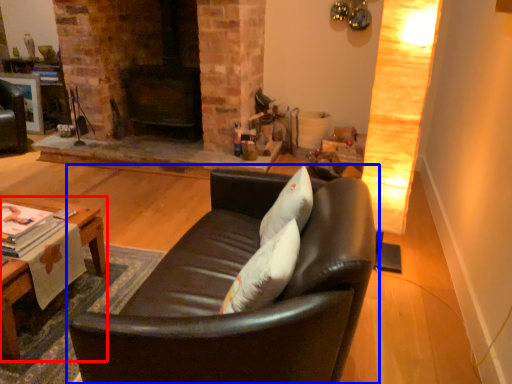
Question: Which of the following is the closest to the observer, table (highlighted by a red box) or studio couch (highlighted by a blue box)?

Choices:
 (A) table
 (B) studio couch

Answer: (B)